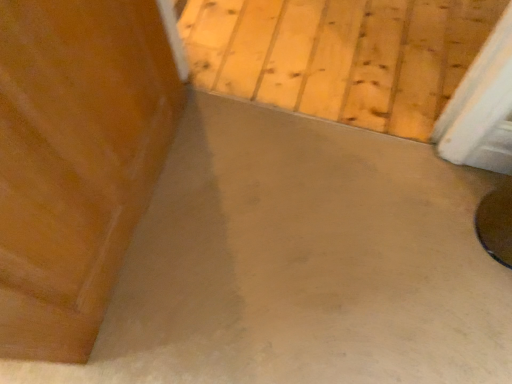
I want to click on free space in front of shiny brown table at lower right, so click(482, 294).